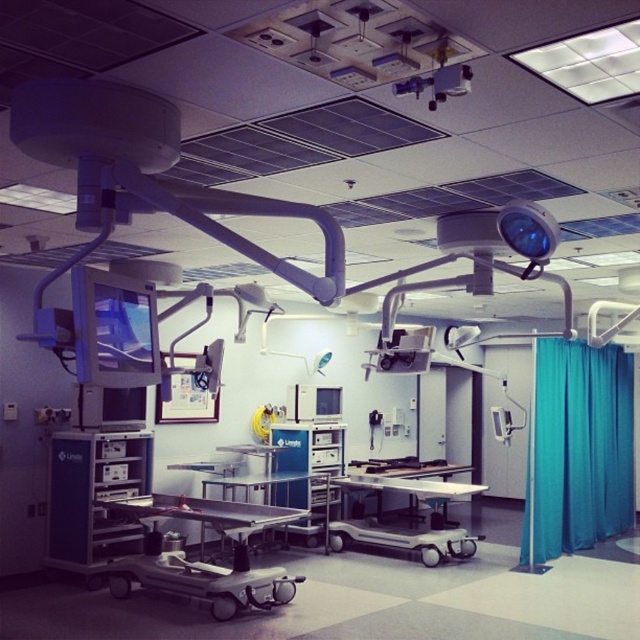
Question: Can you confirm if metallic stainless steel surgical table at center is positioned below metallic silver cart at center?

Choices:
 (A) yes
 (B) no

Answer: (B)

Question: Which object appears farthest from the camera in this image?

Choices:
 (A) metallic silver cart at center
 (B) metallic stainless steel surgical table at center

Answer: (A)

Question: Which point is farther from the camera taking this photo?

Choices:
 (A) [586, 397]
 (B) [340, 520]
 (C) [129, 563]

Answer: (A)

Question: Does teal fabric curtain at right lie in front of metallic silver cart at center?

Choices:
 (A) yes
 (B) no

Answer: (B)

Question: Is teal fabric curtain at right thinner than metallic silver cart at center?

Choices:
 (A) yes
 (B) no

Answer: (B)

Question: Which of the following is the farthest from the observer?

Choices:
 (A) teal fabric curtain at right
 (B) metallic stainless steel surgical table at center

Answer: (A)